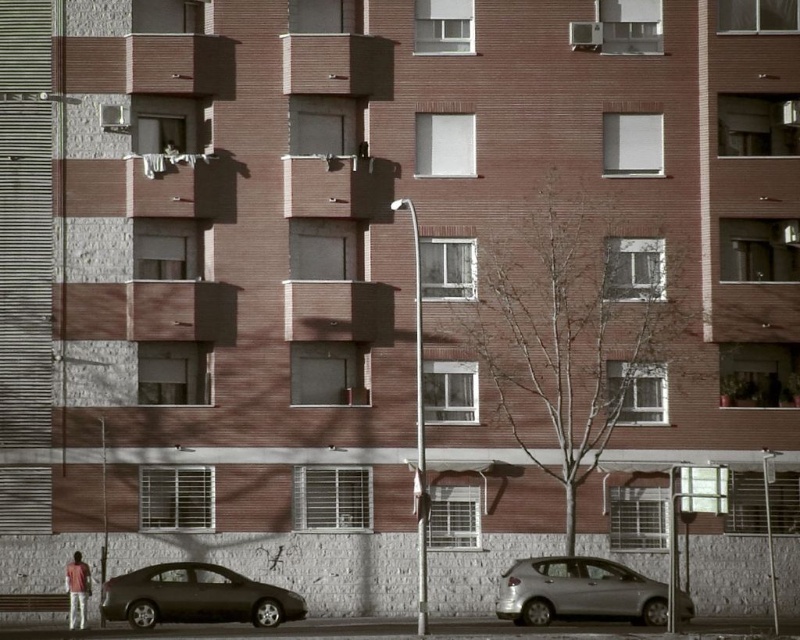
Is point (550, 605) positioned before point (66, 592)?

Yes, it is in front of point (66, 592).

Is silver metallic car at lower center closer to the viewer compared to matte red shirt at lower left?

Yes, silver metallic car at lower center is closer to the viewer.

Locate an element on the screen. The width and height of the screenshot is (800, 640). silver metallic car at lower center is located at coordinates (578, 592).

Between matte black sedan at lower left and silver metallic car at lower center, which one appears on the left side from the viewer's perspective?

matte black sedan at lower left is more to the left.

Which is below, matte black sedan at lower left or silver metallic car at lower center?

matte black sedan at lower left

Between point (182, 577) and point (518, 573), which one is positioned behind?

Point (182, 577)

Where is `matte black sedan at lower left`? This screenshot has width=800, height=640. matte black sedan at lower left is located at coordinates (196, 596).

Is matte black sedan at lower left taller than matte red shirt at lower left?

Correct, matte black sedan at lower left is much taller as matte red shirt at lower left.

Who is more distant from viewer, (294, 611) or (88, 566)?

The point (88, 566) is more distant.

Who is more forward, (281, 600) or (72, 620)?

Point (281, 600)

At what (x,y) coordinates should I click in order to perform the action: click on matte black sedan at lower left. Please return your answer as a coordinate pair (x, y). Looking at the image, I should click on (196, 596).